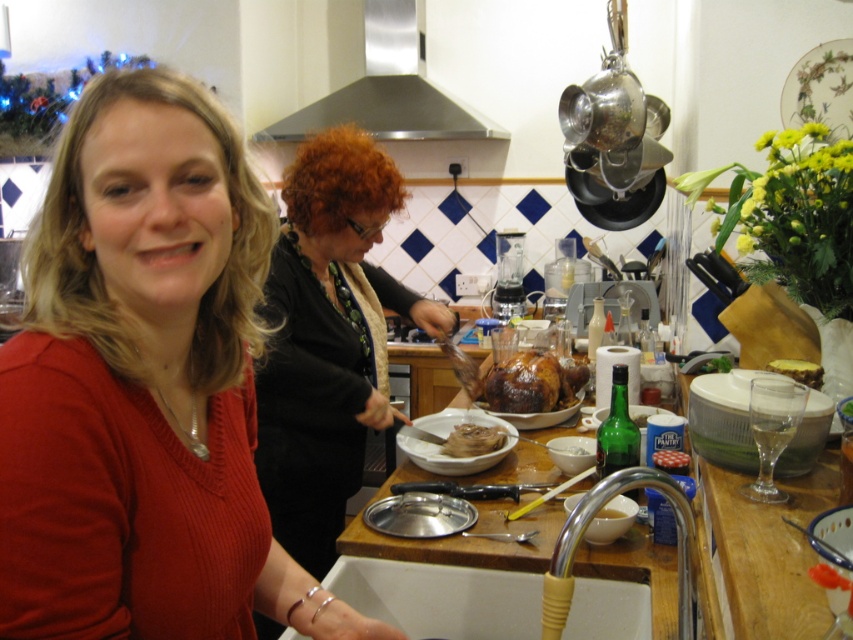
Image resolution: width=853 pixels, height=640 pixels. Describe the element at coordinates (328, 339) in the screenshot. I see `black fabric sweater at center` at that location.

Which is in front, point (274, 440) or point (683, 589)?

Point (683, 589) is more forward.

Where is `black fabric sweater at center`? The image size is (853, 640). black fabric sweater at center is located at coordinates (328, 339).

Between stainless steel exhaust hood at upper center and brown crispy turkey at center, which one appears on the right side from the viewer's perspective?

From the viewer's perspective, brown crispy turkey at center appears more on the right side.

Is point (431, 113) farther from camera compared to point (483, 387)?

Yes, point (431, 113) is behind point (483, 387).

At what (x,y) coordinates should I click in order to perform the action: click on stainless steel exhaust hood at upper center. Please return your answer as a coordinate pair (x, y). Looking at the image, I should click on (387, 90).

Is white ceramic sink at lower center above brown crispy turkey at center?

Incorrect, white ceramic sink at lower center is not positioned above brown crispy turkey at center.

Which is more to the right, white ceramic sink at lower center or brown crispy turkey at center?

brown crispy turkey at center

This screenshot has width=853, height=640. In order to click on white ceramic sink at lower center in this screenshot , I will do `click(461, 593)`.